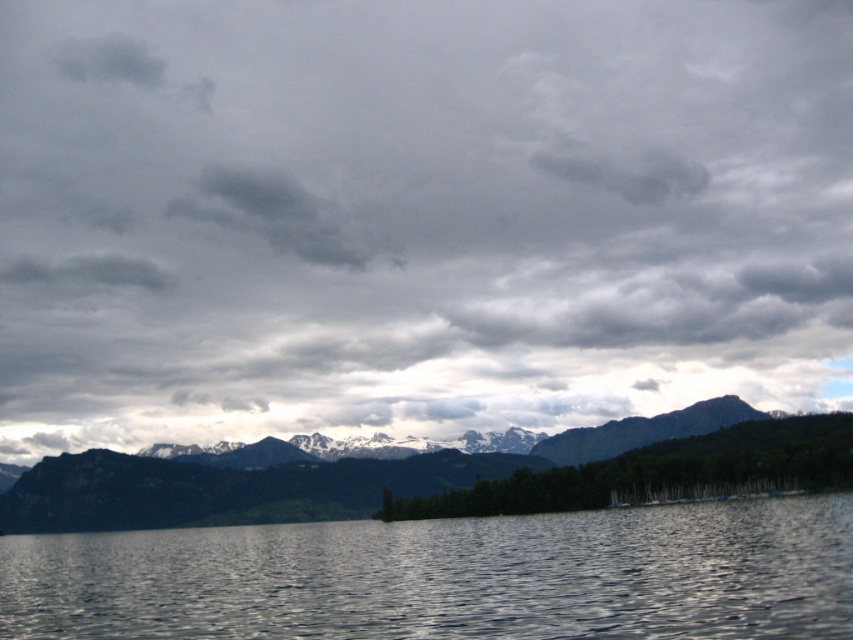
Question: Which of these objects is positioned closest to the cloudy sky at upper center?

Choices:
 (A) snowy rock mountain range at center
 (B) gray fluffy cloud at upper center
 (C) dark gray cloud at upper center

Answer: (C)

Question: Which point is closer to the camera taking this photo?

Choices:
 (A) [x=483, y=632]
 (B) [x=367, y=237]

Answer: (A)

Question: In this image, where is cloudy sky at upper center located relative to snowy rock mountain range at center?

Choices:
 (A) below
 (B) above

Answer: (B)

Question: Is glistening water at lower left below snowy rock mountain range at center?

Choices:
 (A) yes
 (B) no

Answer: (A)

Question: Which object is closer to the camera taking this photo?

Choices:
 (A) dark gray cloud at upper center
 (B) snowy rock mountain range at center
 (C) glistening water at lower left
 (D) gray fluffy cloud at upper center

Answer: (C)

Question: Can you confirm if cloudy sky at upper center is smaller than gray fluffy cloud at upper center?

Choices:
 (A) no
 (B) yes

Answer: (A)